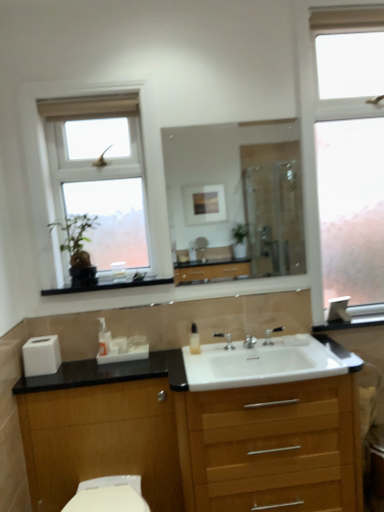
Question: Is the depth of frosted glass window at right, arranged as the second window when viewed from the left, less than that of translucent plastic soap dispenser at center, marked as the second soap dispenser in a right-to-left arrangement?

Choices:
 (A) no
 (B) yes

Answer: (B)

Question: Is frosted glass window at right, acting as the first window starting from the right, at the left side of translucent plastic soap dispenser at center, marked as the second soap dispenser in a right-to-left arrangement?

Choices:
 (A) yes
 (B) no

Answer: (B)

Question: Is frosted glass window at right, arranged as the second window when viewed from the left, shorter than translucent plastic soap dispenser at center, marked as the second soap dispenser in a right-to-left arrangement?

Choices:
 (A) yes
 (B) no

Answer: (B)

Question: Can translucent plastic soap dispenser at center, arranged as the 1th soap dispenser when viewed from the left, be found inside frosted glass window at right, arranged as the second window when viewed from the left?

Choices:
 (A) no
 (B) yes

Answer: (A)

Question: Does frosted glass window at right, acting as the first window starting from the right, have a smaller size compared to translucent plastic soap dispenser at center, marked as the second soap dispenser in a right-to-left arrangement?

Choices:
 (A) yes
 (B) no

Answer: (B)

Question: Is frosted glass window at right, acting as the first window starting from the right, bigger than translucent plastic soap dispenser at center, marked as the second soap dispenser in a right-to-left arrangement?

Choices:
 (A) yes
 (B) no

Answer: (A)

Question: Is white glossy toilet bowl at lower left thinner than white matte toilet paper at lower left?

Choices:
 (A) yes
 (B) no

Answer: (B)

Question: Is the position of white glossy toilet bowl at lower left more distant than that of white matte toilet paper at lower left?

Choices:
 (A) yes
 (B) no

Answer: (B)

Question: Are white glossy toilet bowl at lower left and white matte toilet paper at lower left far apart?

Choices:
 (A) no
 (B) yes

Answer: (A)

Question: Is white glossy toilet bowl at lower left taller than white matte toilet paper at lower left?

Choices:
 (A) no
 (B) yes

Answer: (B)

Question: Is white glossy toilet bowl at lower left wider than white matte toilet paper at lower left?

Choices:
 (A) yes
 (B) no

Answer: (A)

Question: From the image's perspective, is white glossy toilet bowl at lower left on top of white matte toilet paper at lower left?

Choices:
 (A) yes
 (B) no

Answer: (B)

Question: From the image's perspective, is translucent plastic soap dispenser at center, marked as the second soap dispenser in a right-to-left arrangement, below silver metallic tap at center, marked as the 1th tap in a left-to-right arrangement?

Choices:
 (A) yes
 (B) no

Answer: (B)